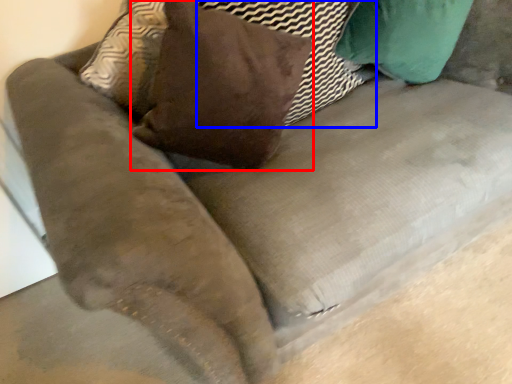
Question: Which point is closer to the camera, throw pillow (highlighted by a red box) or pillow (highlighted by a blue box)?

Choices:
 (A) throw pillow
 (B) pillow

Answer: (A)